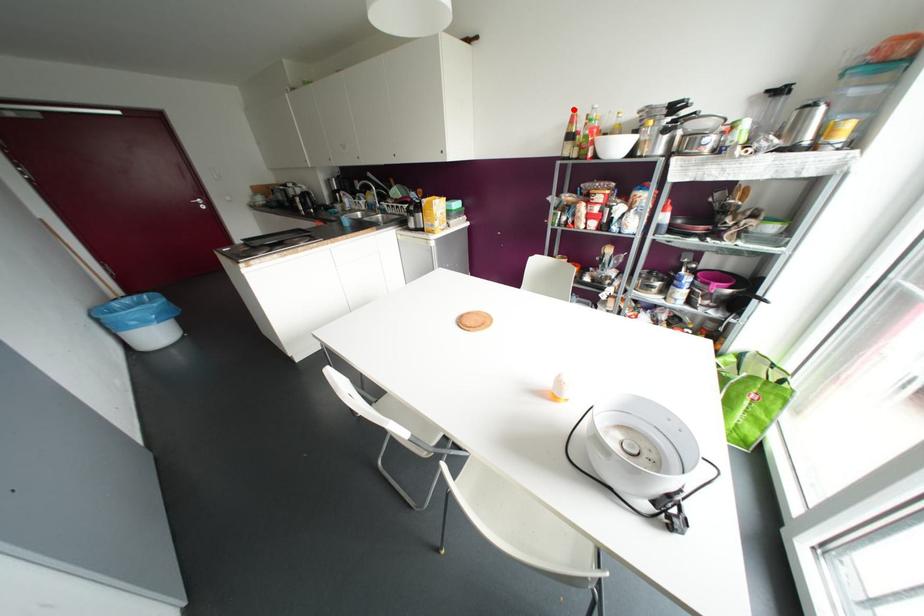
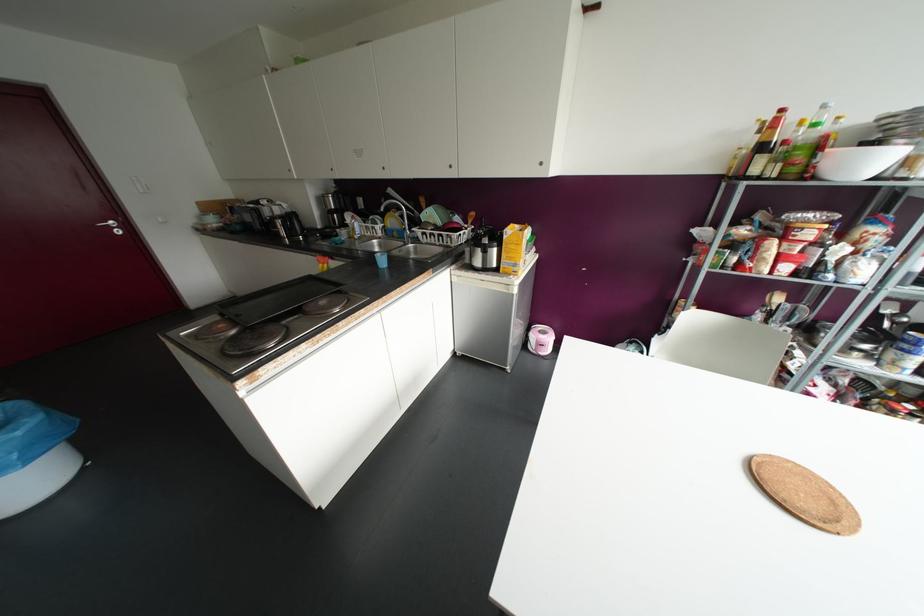
Locate, in the second image, the point that corresponds to the highlighted location in the first image.

(781, 110)